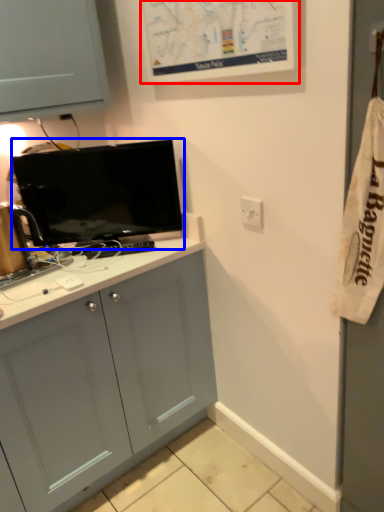
Question: Which point is closer to the camera, bulletin board (highlighted by a red box) or television (highlighted by a blue box)?

Choices:
 (A) bulletin board
 (B) television

Answer: (A)